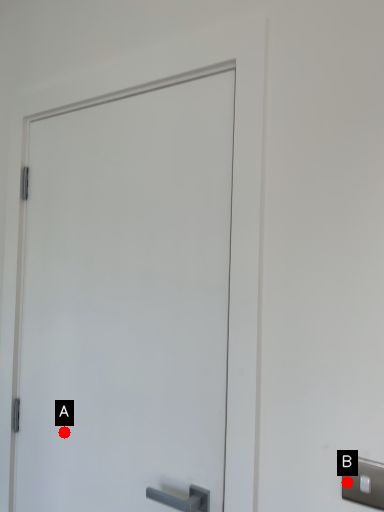
Question: Two points are circled on the image, labeled by A and B beside each circle. Which of the following is the farthest from the observer?

Choices:
 (A) A is further
 (B) B is further

Answer: (A)